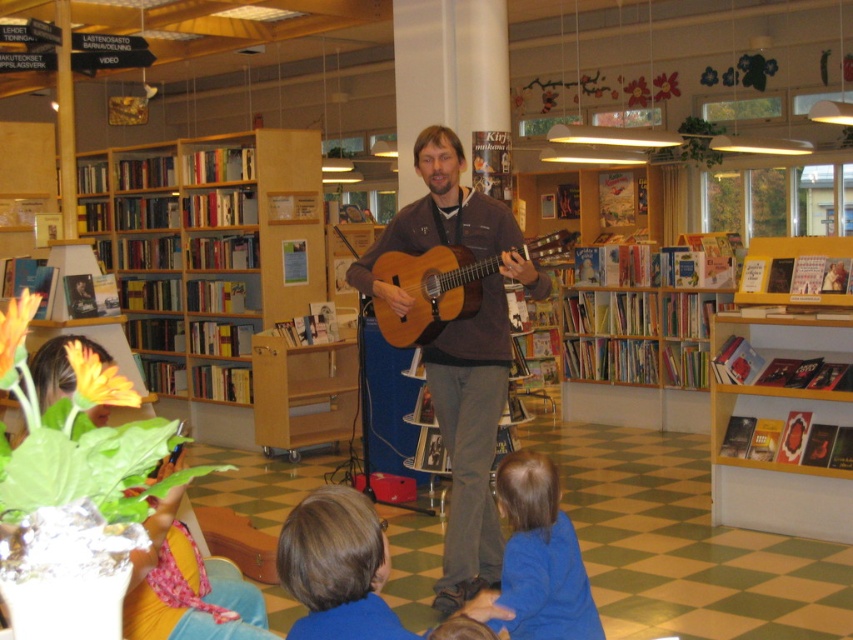
Question: Based on their relative distances, which object is nearer to the yellow wooden bookshelf at right?

Choices:
 (A) blue soft fabric at lower center
 (B) matte brown guitar at center

Answer: (B)

Question: Which object is closer to the camera taking this photo?

Choices:
 (A) blue soft fabric at lower center
 (B) matte brown guitar at center
 (C) wooden acoustic guitar at center
 (D) wooden bookshelf at left

Answer: (A)

Question: Can you confirm if matte brown guitar at center is wider than blue soft fabric at lower center?

Choices:
 (A) yes
 (B) no

Answer: (A)

Question: Is yellow wooden bookshelf at right above blue soft fabric at lower center?

Choices:
 (A) yes
 (B) no

Answer: (A)

Question: Which of the following is the farthest from the observer?

Choices:
 (A) (589, 627)
 (B) (318, 268)
 (C) (453, 269)

Answer: (B)

Question: Does blue soft fabric at lower center appear over wooden acoustic guitar at center?

Choices:
 (A) no
 (B) yes

Answer: (A)